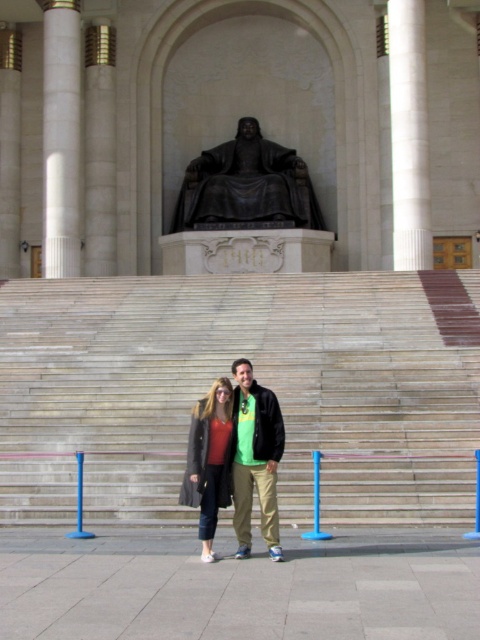
You are an architect visiting the historical building and want to compare the two white marble structures in front of you. Which one is taller between the white marble column at left and the white marble pillar at right?

The white marble column at left is taller than the white marble pillar at right.

You are a tour guide leading a group near the grand building. You need to move a 10 feet wide stage between the white marble column at left and the white marble pillar at right. Will the stage fit through the space between them?

The distance between the white marble column at left and the white marble pillar at right is 48.58 feet. Since the stage is only 10 feet wide, it will easily fit through the space between them.

You are standing in front of the grand building and want to take a photo of both the bronze statue at center and the white marble pillar at right. Since you can only focus on one object at a time, which one should you adjust your camera focus for first to ensure it appears sharp in the photo?

The bronze statue at center is closer to you than the white marble pillar at right, so you should focus on the bronze statue at center first to ensure it appears sharp in the photo.